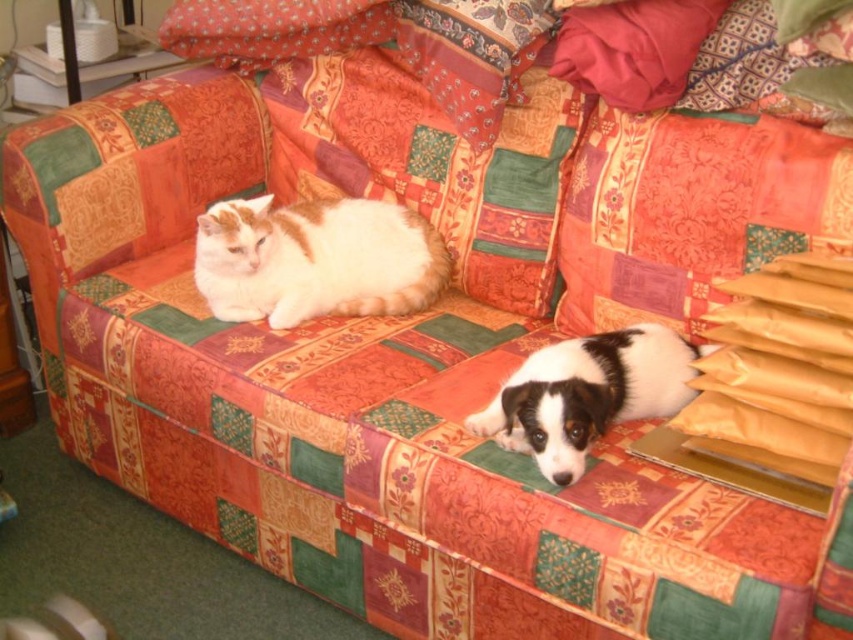
Question: Where is orange fabric pillow at upper right located in relation to black and white fur at center in the image?

Choices:
 (A) above
 (B) below

Answer: (A)

Question: Is white and orange fur cat at center smaller than black and white fur at center?

Choices:
 (A) yes
 (B) no

Answer: (B)

Question: Which object is positioned closest to the white and orange fur cat at center?

Choices:
 (A) black and white fur at center
 (B) orange fabric pillow at upper right

Answer: (A)

Question: Is orange fabric pillow at upper right behind white and orange fur cat at center?

Choices:
 (A) yes
 (B) no

Answer: (B)

Question: Which is nearer to the orange fabric pillow at upper right?

Choices:
 (A) black and white fur at center
 (B) white and orange fur cat at center

Answer: (A)

Question: Which point is closer to the camera taking this photo?

Choices:
 (A) (553, 435)
 (B) (334, 241)

Answer: (A)